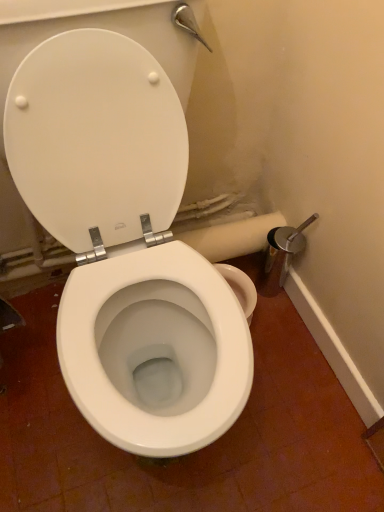
Question: Does white plastic toilet seat at center have a lesser width compared to white glossy toilet at center?

Choices:
 (A) yes
 (B) no

Answer: (A)

Question: From the image's perspective, is white plastic toilet seat at center located above white glossy toilet at center?

Choices:
 (A) no
 (B) yes

Answer: (B)

Question: Does white plastic toilet seat at center have a greater width compared to white glossy toilet at center?

Choices:
 (A) no
 (B) yes

Answer: (A)

Question: Considering the relative sizes of white plastic toilet seat at center and white glossy toilet at center in the image provided, is white plastic toilet seat at center taller than white glossy toilet at center?

Choices:
 (A) no
 (B) yes

Answer: (A)

Question: Is white plastic toilet seat at center in front of white glossy toilet at center?

Choices:
 (A) yes
 (B) no

Answer: (B)

Question: Is point (84, 84) positioned closer to the camera than point (281, 219)?

Choices:
 (A) closer
 (B) farther

Answer: (A)

Question: In terms of size, does white plastic toilet seat at center appear bigger or smaller than white matte toilet paper at center?

Choices:
 (A) small
 (B) big

Answer: (B)

Question: From the image's perspective, is white plastic toilet seat at center positioned above or below white matte toilet paper at center?

Choices:
 (A) below
 (B) above

Answer: (B)

Question: Looking at their shapes, would you say white plastic toilet seat at center is wider or thinner than white matte toilet paper at center?

Choices:
 (A) wide
 (B) thin

Answer: (B)

Question: From a real-world perspective, is white glossy toilet at center physically located above or below white plastic toilet seat at center?

Choices:
 (A) above
 (B) below

Answer: (A)

Question: From the image's perspective, is white glossy toilet at center located above or below white plastic toilet seat at center?

Choices:
 (A) below
 (B) above

Answer: (A)

Question: Considering the positions of point (125, 320) and point (87, 108), is point (125, 320) closer or farther from the camera than point (87, 108)?

Choices:
 (A) closer
 (B) farther

Answer: (B)

Question: Would you say white glossy toilet at center is to the left or to the right of white plastic toilet seat at center in the picture?

Choices:
 (A) left
 (B) right

Answer: (B)

Question: From a real-world perspective, relative to white glossy toilet at center, is white matte toilet paper at center vertically above or below?

Choices:
 (A) above
 (B) below

Answer: (B)

Question: From the image's perspective, is white matte toilet paper at center above or below white glossy toilet at center?

Choices:
 (A) above
 (B) below

Answer: (A)